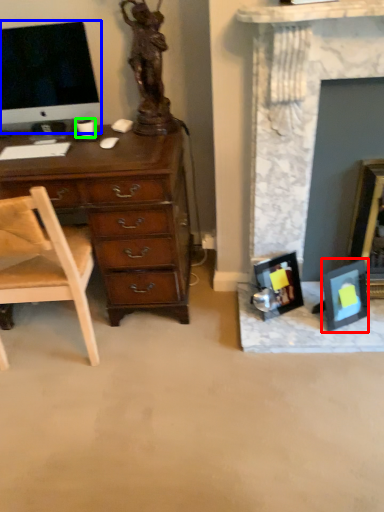
Question: Which is nearer to the picture frame (highlighted by a red box)? television (highlighted by a blue box) or coffee cup (highlighted by a green box).

Choices:
 (A) television
 (B) coffee cup

Answer: (B)